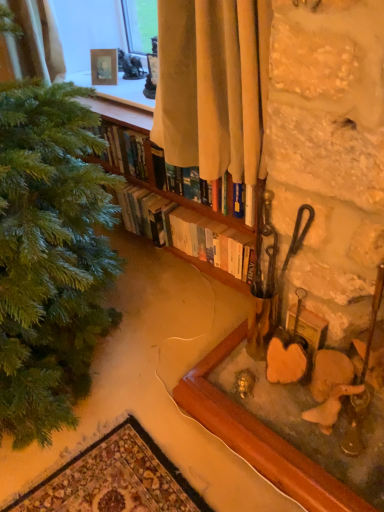
Question: Is wooden frame at upper center, which is counted as the 2th picture frame, starting from the bottom, positioned beyond the bounds of hardcover books at center?

Choices:
 (A) no
 (B) yes

Answer: (B)

Question: From a real-world perspective, is wooden frame at upper center, the 1th picture frame positioned from the left, positioned over hardcover books at center based on gravity?

Choices:
 (A) no
 (B) yes

Answer: (B)

Question: Are wooden frame at upper center, marked as the second picture frame in a front-to-back arrangement, and hardcover books at center far apart?

Choices:
 (A) no
 (B) yes

Answer: (A)

Question: Is the depth of wooden frame at upper center, the second picture frame in the right-to-left sequence, greater than that of hardcover books at center?

Choices:
 (A) yes
 (B) no

Answer: (A)

Question: From a real-world perspective, is wooden frame at upper center, the 1th picture frame positioned from the left, under hardcover books at center?

Choices:
 (A) yes
 (B) no

Answer: (B)

Question: Are wooden frame at upper center, marked as the second picture frame in a front-to-back arrangement, and hardcover books at center making contact?

Choices:
 (A) yes
 (B) no

Answer: (B)

Question: Is wooden frame at upper center, the first picture frame from the top, positioned with its back to wooden picture frame at lower right, acting as the 1th picture frame starting from the bottom?

Choices:
 (A) no
 (B) yes

Answer: (A)

Question: Could you tell me if wooden frame at upper center, the 1th picture frame positioned from the left, is facing wooden picture frame at lower right, which appears as the first picture frame when viewed from the right?

Choices:
 (A) yes
 (B) no

Answer: (B)

Question: Is wooden picture frame at lower right, acting as the 1th picture frame starting from the bottom, surrounded by wooden frame at upper center, which is counted as the 2th picture frame, starting from the bottom?

Choices:
 (A) no
 (B) yes

Answer: (A)

Question: Does wooden frame at upper center, the 1th picture frame positioned from the left, appear on the left side of wooden picture frame at lower right, acting as the first picture frame starting from the front?

Choices:
 (A) no
 (B) yes

Answer: (B)

Question: From the image's perspective, is wooden frame at upper center, which is counted as the 2th picture frame, starting from the bottom, located above wooden picture frame at lower right, acting as the 2th picture frame starting from the back?

Choices:
 (A) yes
 (B) no

Answer: (A)

Question: Considering the relative positions of wooden frame at upper center, the first picture frame positioned from the back, and wooden picture frame at lower right, which appears as the first picture frame when viewed from the right, in the image provided, is wooden frame at upper center, the first picture frame positioned from the back, in front of wooden picture frame at lower right, which appears as the first picture frame when viewed from the right,?

Choices:
 (A) no
 (B) yes

Answer: (A)

Question: Does beige fabric curtain at upper center appear on the right side of hardcover books at center?

Choices:
 (A) no
 (B) yes

Answer: (B)